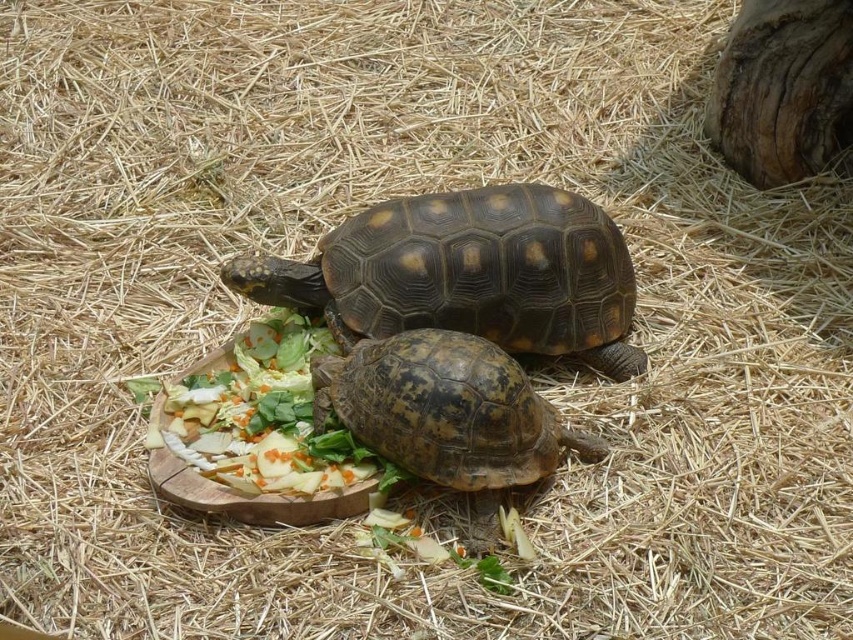
You are a caretaker standing 1.5 meters away from the brown rough textured tortoise at center. Can you safely reach out to touch it without moving closer?

The brown rough textured tortoise at center is 1.79 meters away from the viewer. Since you are standing 1.5 meters away, you are closer than the tortoise, so you can safely reach out to touch it without needing to move closer.